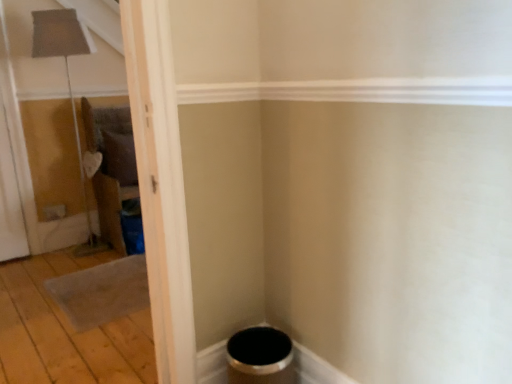
Image resolution: width=512 pixels, height=384 pixels. Identify the location of vacant region above wooden floor at lower left (from a real-world perspective). (79, 303).